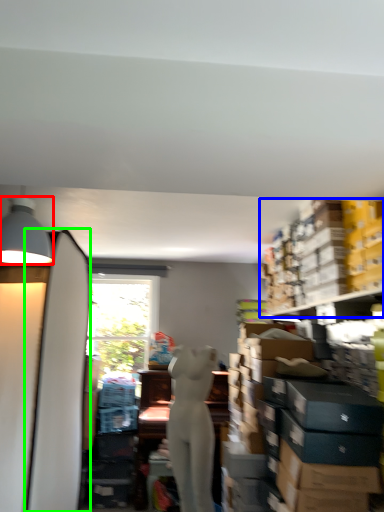
Question: Based on their relative distances, which object is nearer to lamp (highlighted by a red box)? Choose from shelf (highlighted by a blue box) and surfboard (highlighted by a green box).

Choices:
 (A) shelf
 (B) surfboard

Answer: (B)